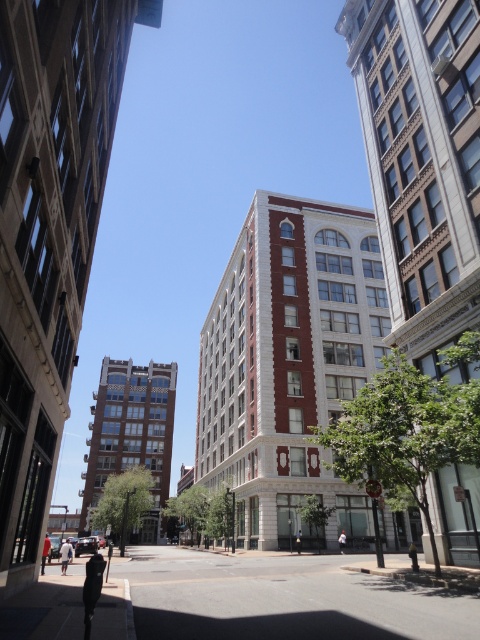
Is dark blue jeans at lower left to the left of orange shirt at center from the viewer's perspective?

In fact, dark blue jeans at lower left is to the right of orange shirt at center.

Can you confirm if dark blue jeans at lower left is thinner than orange shirt at center?

Yes.

Is point (86, 609) positioned before point (44, 566)?

Yes.

Identify the location of dark blue jeans at lower left. The height and width of the screenshot is (640, 480). (92, 588).

Based on the photo, is dark blue jeans at lower left below white cotton shirt at lower left?

Actually, dark blue jeans at lower left is above white cotton shirt at lower left.

Image resolution: width=480 pixels, height=640 pixels. Find the location of `dark blue jeans at lower left`. dark blue jeans at lower left is located at coordinates (92, 588).

I want to click on dark blue jeans at lower left, so click(x=92, y=588).

In the scene shown: Does white cotton shirt at lower left appear on the left side of white cotton shirt at center?

Yes, white cotton shirt at lower left is to the left of white cotton shirt at center.

Does white cotton shirt at lower left have a lesser width compared to white cotton shirt at center?

No.

Locate an element on the screen. The width and height of the screenshot is (480, 640). white cotton shirt at lower left is located at coordinates (66, 556).

This screenshot has height=640, width=480. I want to click on white cotton shirt at lower left, so click(x=66, y=556).